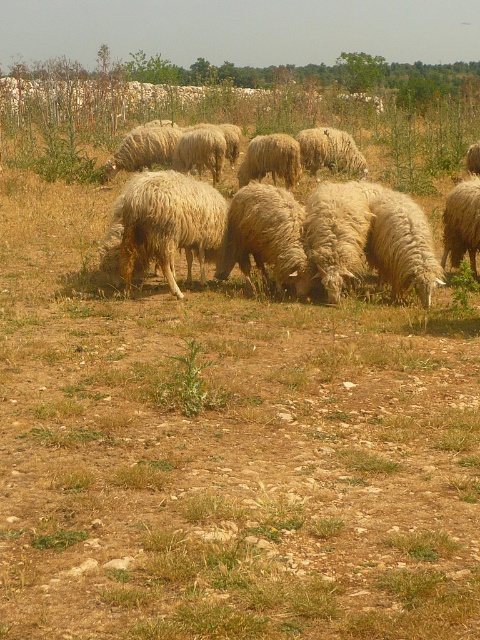
Question: Which of the following is the farthest from the observer?

Choices:
 (A) (465, 237)
 (B) (338, 132)

Answer: (B)

Question: Where is fuzzy woolly sheep at center located in relation to fluffy beige wool at center in the image?

Choices:
 (A) above
 (B) below

Answer: (B)

Question: Does fuzzy woolly sheep at center appear under fluffy beige wool at center?

Choices:
 (A) yes
 (B) no

Answer: (A)

Question: Which object is positioned closest to the fuzzy white sheep at center?

Choices:
 (A) fluffy beige wool at center
 (B) white woolly sheep at right

Answer: (A)

Question: Which object appears closest to the camera in this image?

Choices:
 (A) fuzzy woolly sheep at center
 (B) white woolly sheep at right
 (C) white woolly sheep at center
 (D) fluffy beige wool at center

Answer: (A)

Question: Can you confirm if fuzzy woolly sheep at center is bigger than white woolly sheep at center?

Choices:
 (A) no
 (B) yes

Answer: (B)